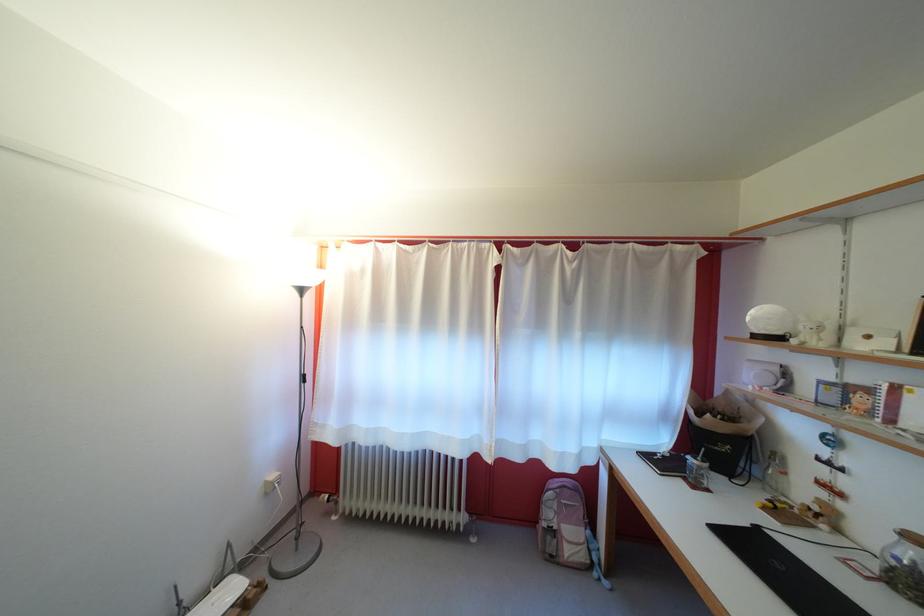
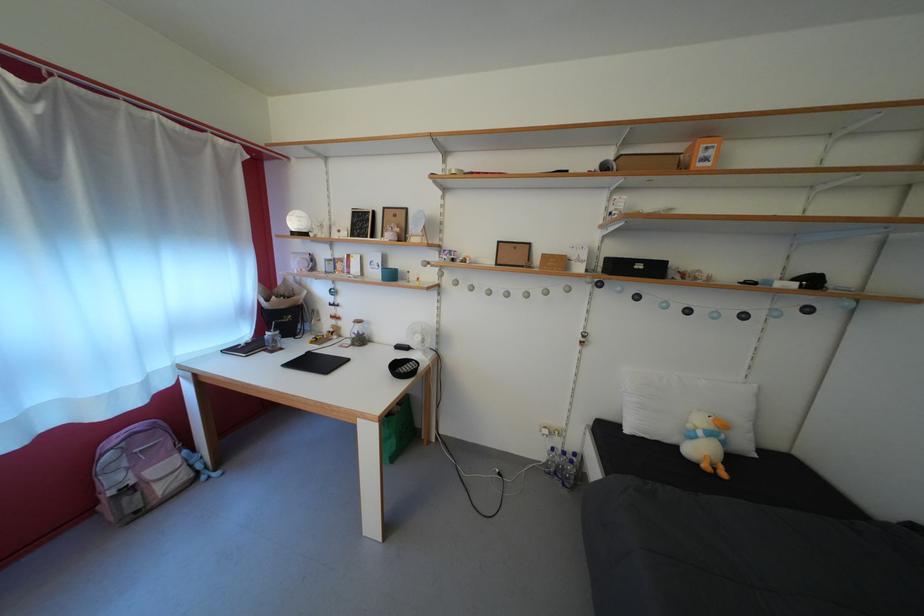
The point at (x=882, y=541) is marked in the first image. Where is the corresponding point in the second image?

(358, 334)